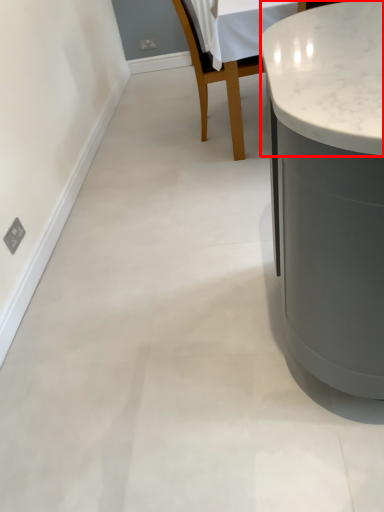
Question: From the image's perspective, where is counter top (annotated by the red box) located in relation to chair in the image?

Choices:
 (A) above
 (B) below

Answer: (A)